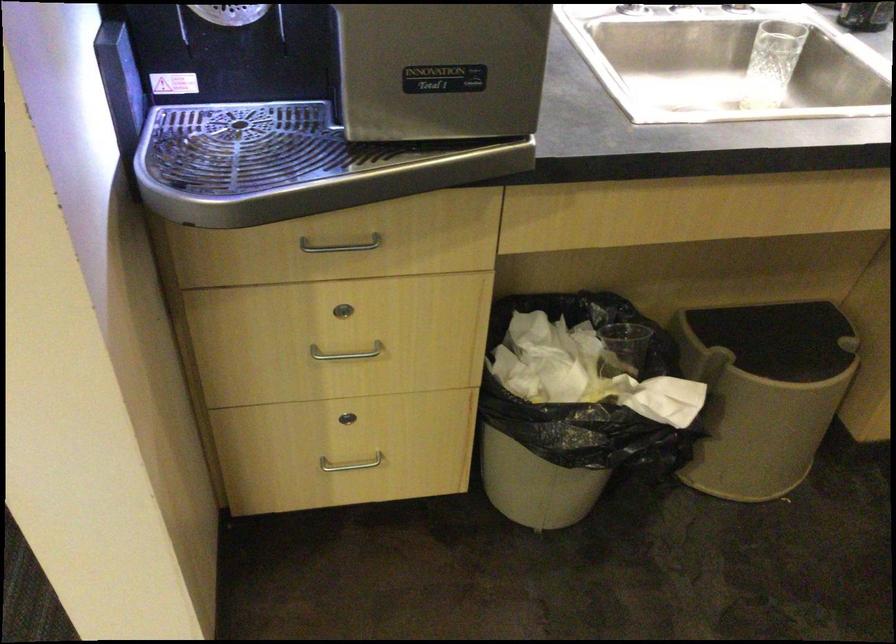
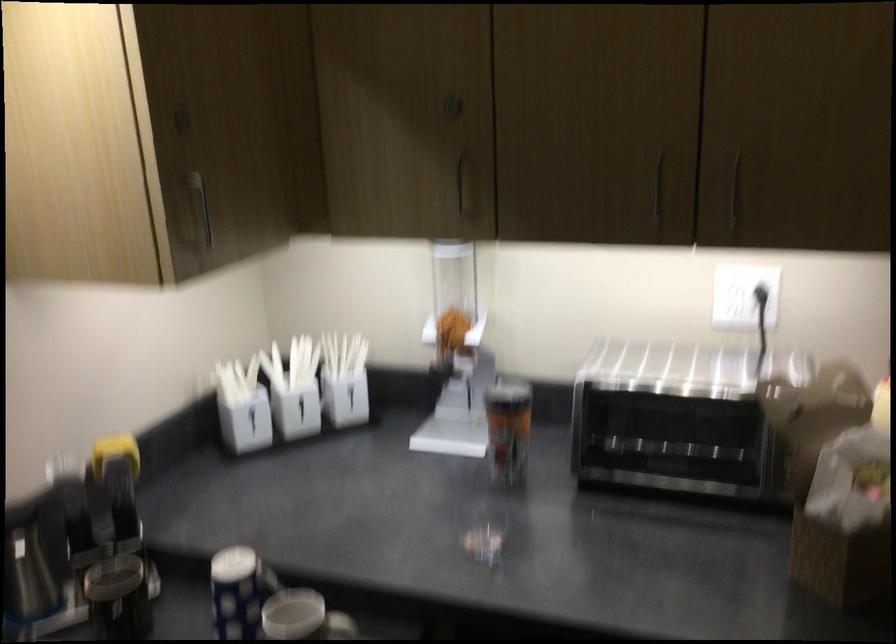
Question: The first image is from the beginning of the video and the second image is from the end. How did the camera likely rotate when shooting the video?

Choices:
 (A) Left
 (B) Right
 (C) Up
 (D) Down

Answer: (B)